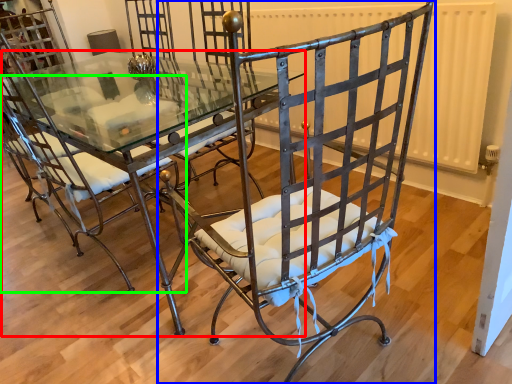
Question: Estimate the real-world distances between objects in this image. Which object is closer to table (highlighted by a red box), chair (highlighted by a blue box) or chair (highlighted by a green box)?

Choices:
 (A) chair
 (B) chair

Answer: (B)